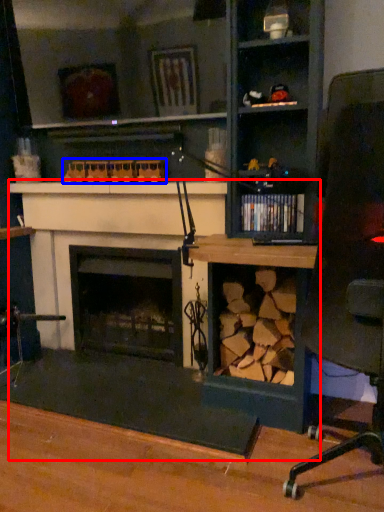
Question: Which of the following is the closest to the observer, computer desk (highlighted by a red box) or toy (highlighted by a blue box)?

Choices:
 (A) computer desk
 (B) toy

Answer: (A)